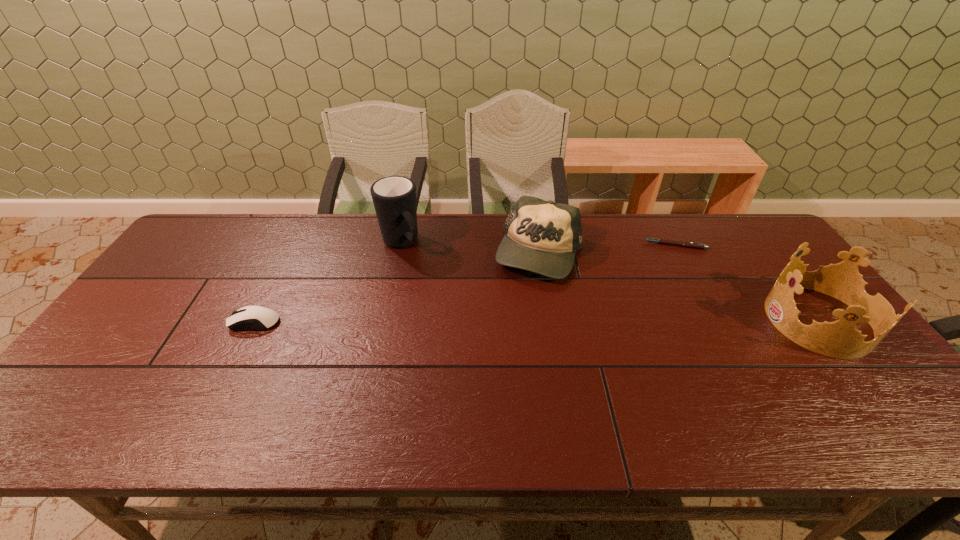
Locate an element on the screen. This screenshot has height=540, width=960. vacant space on the desktop that is between the mouse and the tiara and is positioned at the nib of the shortest object is located at coordinates (590, 321).

At what (x,y) coordinates should I click in order to perform the action: click on vacant space on the desktop that is between the leftmost object and the rightmost object and is positioned on the front-facing side of the third object from left to right. Please return your answer as a coordinate pair (x, y). The height and width of the screenshot is (540, 960). Looking at the image, I should click on (491, 321).

At what (x,y) coordinates should I click in order to perform the action: click on vacant space on the desktop that is between the mouse and the tiara and is positioned on the side of the mug with the handle. Please return your answer as a coordinate pair (x, y). The image size is (960, 540). Looking at the image, I should click on (471, 321).